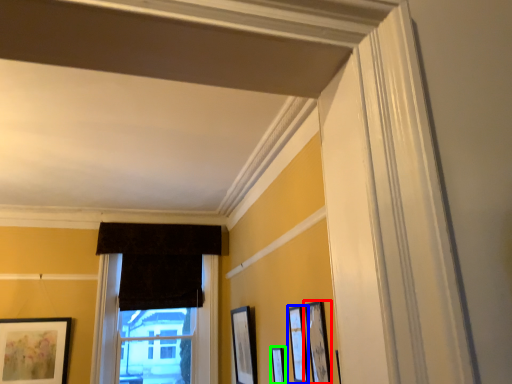
Question: Considering the real-world distances, which object is closest to picture frame (highlighted by a red box)? picture frame (highlighted by a blue box) or picture frame (highlighted by a green box).

Choices:
 (A) picture frame
 (B) picture frame

Answer: (A)